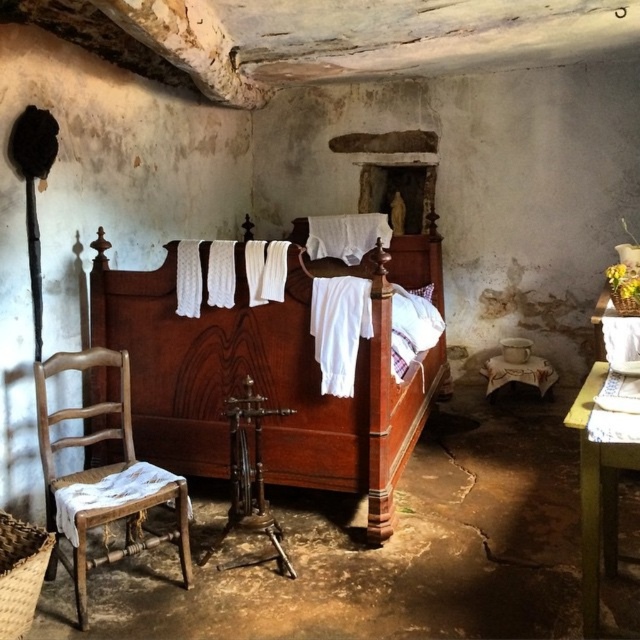
Between point (243, 314) and point (502, 371), which one is positioned in front?

Positioned in front is point (243, 314).

Can you confirm if polished wood bed at center is positioned to the right of white cloth-covered stool at lower right?

In fact, polished wood bed at center is to the left of white cloth-covered stool at lower right.

Identify the location of polished wood bed at center. (273, 372).

Is worn wood chair at left shorter than white cloth-covered stool at lower right?

No.

Between point (49, 564) and point (540, 385), which one is positioned in front?

Point (49, 564)

The width and height of the screenshot is (640, 640). What do you see at coordinates (83, 419) in the screenshot?
I see `worn wood chair at left` at bounding box center [83, 419].

This screenshot has width=640, height=640. I want to click on worn wood chair at left, so click(x=83, y=419).

Does polished wood bed at center appear over worn wood chair at left?

Yes.

Image resolution: width=640 pixels, height=640 pixels. What do you see at coordinates (273, 372) in the screenshot?
I see `polished wood bed at center` at bounding box center [273, 372].

Locate an element on the screen. Image resolution: width=640 pixels, height=640 pixels. polished wood bed at center is located at coordinates (273, 372).